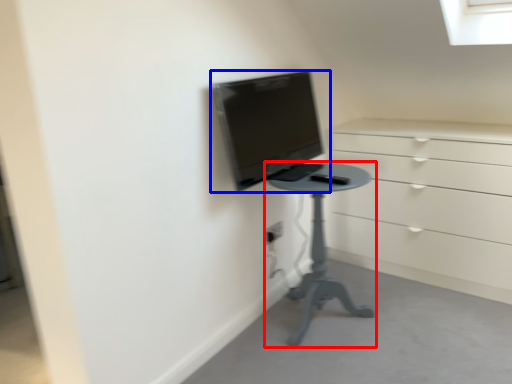
Question: Which object is closer to the camera taking this photo, furniture (highlighted by a red box) or computer monitor (highlighted by a blue box)?

Choices:
 (A) furniture
 (B) computer monitor

Answer: (B)